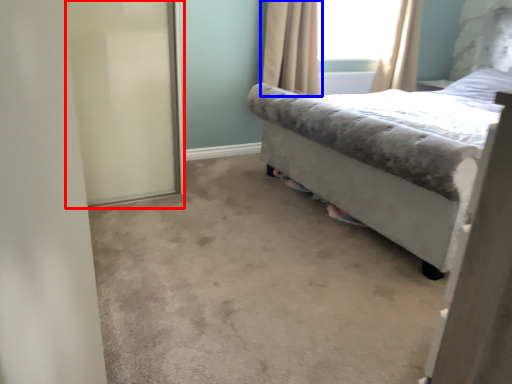
Question: Which of the following is the farthest to the observer, screen door (highlighted by a red box) or curtain (highlighted by a blue box)?

Choices:
 (A) screen door
 (B) curtain

Answer: (B)